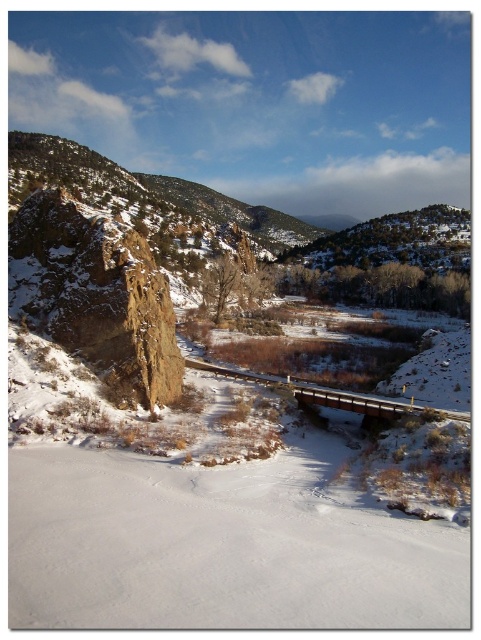
You are standing at the point closest to the camera in the winter landscape image. Which point, point [19,253] or point [367,412], are you standing at?

You are standing at point [19,253] because it is further to the camera than point [367,412].

You are an explorer trying to cross the frozen waterway. You see the brown wooden bridge at center and the brown rough rock at left. Which structure is taller and can provide a better vantage point for observing the surrounding area?

The brown rough rock at left is much taller than the brown wooden bridge at center, so it can provide a better vantage point for observing the surrounding area.